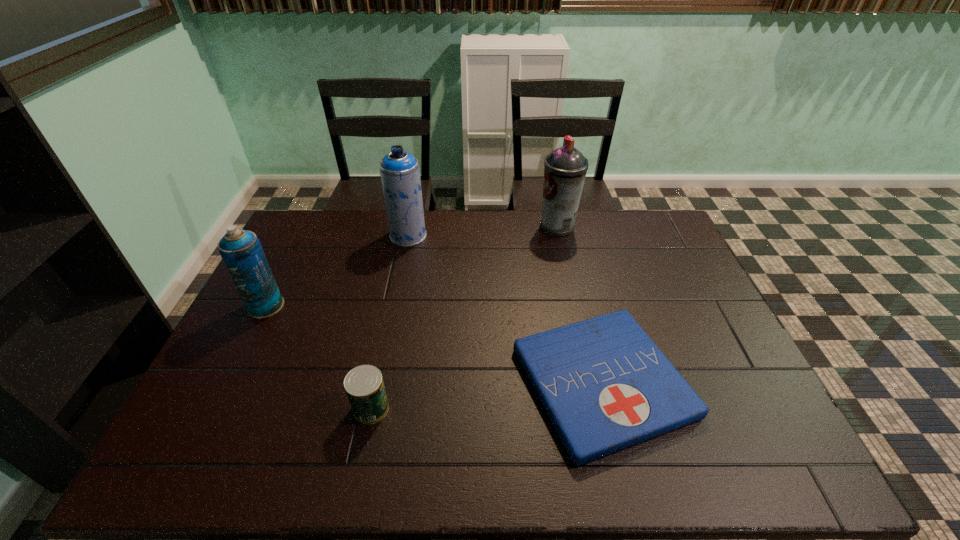
The height and width of the screenshot is (540, 960). Find the location of `vacant region located on the left of the shortest object`. vacant region located on the left of the shortest object is located at coordinates pos(430,382).

Where is `object at the near edge`? This screenshot has width=960, height=540. object at the near edge is located at coordinates (605, 385).

Find the location of a particular element. This screenshot has width=960, height=540. object situated at the left edge is located at coordinates (241, 251).

Where is `object at the right edge`? This screenshot has height=540, width=960. object at the right edge is located at coordinates (605, 385).

Identify the location of object that is positioned at the near right corner. (605, 385).

This screenshot has width=960, height=540. Identify the location of vacant space at the far edge. (603, 232).

Locate an element on the screen. The width and height of the screenshot is (960, 540). vacant region at the left edge of the desktop is located at coordinates (315, 271).

At what (x,y) coordinates should I click in order to perform the action: click on vacant area at the right edge. Please return your answer as a coordinate pair (x, y). The image size is (960, 540). Looking at the image, I should click on (725, 411).

At what (x,y) coordinates should I click in order to perform the action: click on vacant space at the near left corner. Please return your answer as a coordinate pair (x, y). Looking at the image, I should click on (211, 454).

This screenshot has width=960, height=540. In order to click on free space at the far right corner of the desktop in this screenshot , I will do `click(626, 229)`.